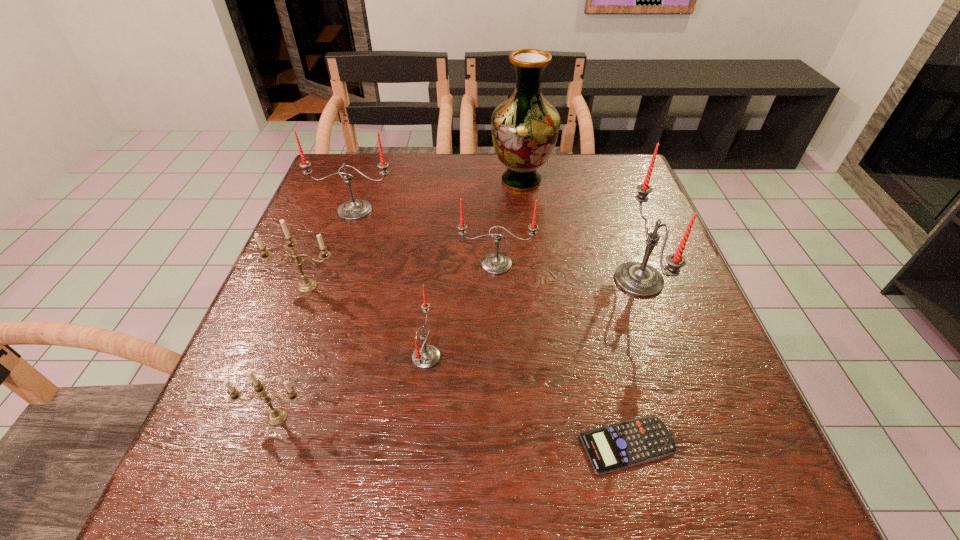
In order to click on vase in this screenshot , I will do `click(525, 127)`.

Image resolution: width=960 pixels, height=540 pixels. I want to click on the farthest object, so click(x=525, y=127).

Where is `the tallest candle`? the tallest candle is located at coordinates (639, 279).

This screenshot has height=540, width=960. Identify the location of the biggest red candle. (639, 279).

The image size is (960, 540). In order to click on the leftmost red candle in this screenshot , I will do `click(354, 209)`.

This screenshot has width=960, height=540. Find the location of `the second farthest object`. the second farthest object is located at coordinates (354, 209).

Identify the location of the second red candle from right to left. This screenshot has height=540, width=960. (496, 263).

Identify the location of the fifth candle from left to right. This screenshot has width=960, height=540. (496, 263).

Identify the location of the bigger metallic candle. (306, 285).

Identify the location of the nearest red candle. The height and width of the screenshot is (540, 960). (426, 356).